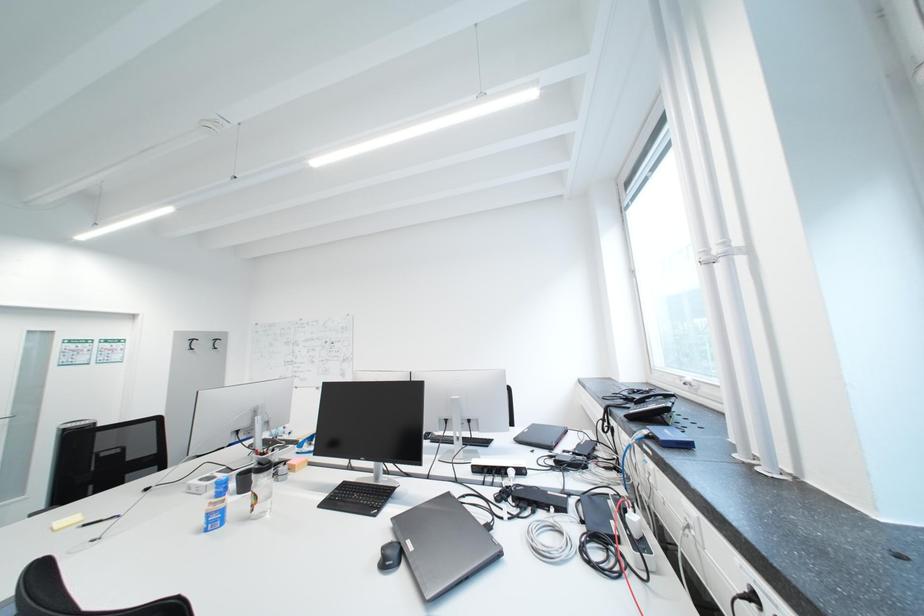
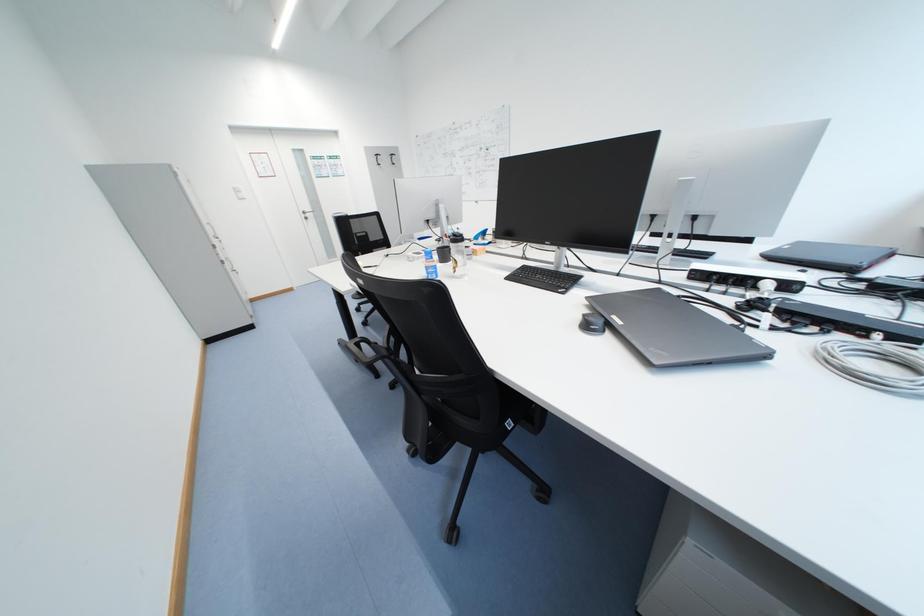
How did the camera likely rotate?

The rotation direction of the camera is left-down.